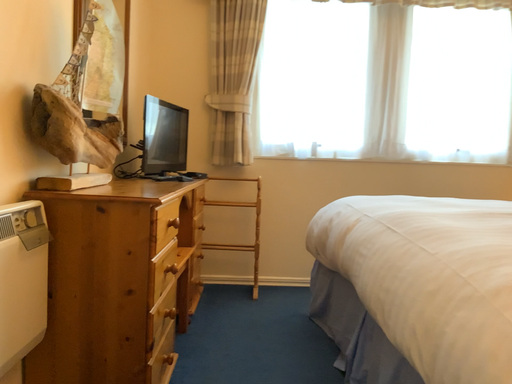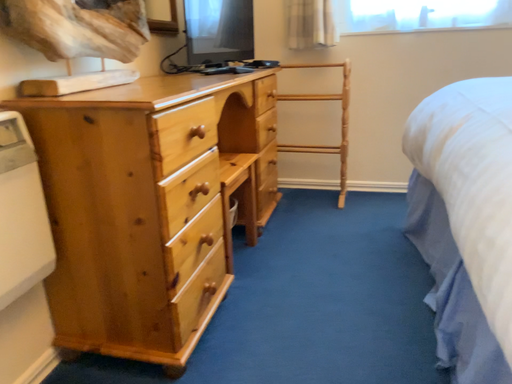
Question: How did the camera likely rotate when shooting the video?

Choices:
 (A) rotated downward
 (B) rotated upward

Answer: (A)